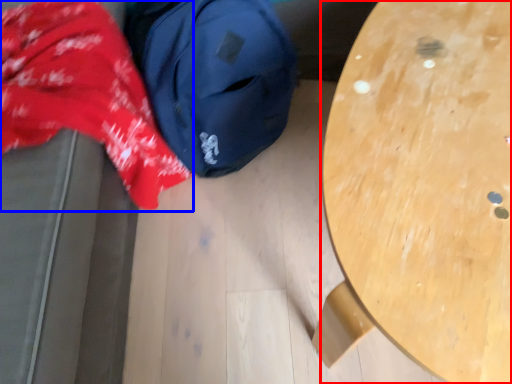
Question: Which object is further to the camera taking this photo, table (highlighted by a red box) or clothing (highlighted by a blue box)?

Choices:
 (A) table
 (B) clothing

Answer: (A)